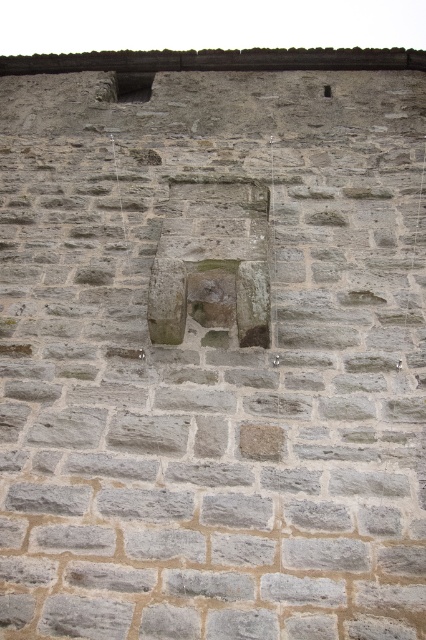
Question: Among these objects, which one is nearest to the camera?

Choices:
 (A) gray stone hole at upper center
 (B) matte stone window at upper left

Answer: (A)

Question: Observing the image, what is the correct spatial positioning of matte stone window at upper left in reference to gray stone hole at upper center?

Choices:
 (A) below
 (B) above

Answer: (B)

Question: Does matte stone window at upper left have a lesser width compared to gray stone hole at upper center?

Choices:
 (A) no
 (B) yes

Answer: (A)

Question: Among these points, which one is nearest to the camera?

Choices:
 (A) (141, 83)
 (B) (325, 84)

Answer: (B)

Question: From the image, what is the correct spatial relationship of matte stone window at upper left in relation to gray stone hole at upper center?

Choices:
 (A) right
 (B) left

Answer: (B)

Question: Which point is closer to the camera?

Choices:
 (A) matte stone window at upper left
 (B) gray stone hole at upper center

Answer: (B)